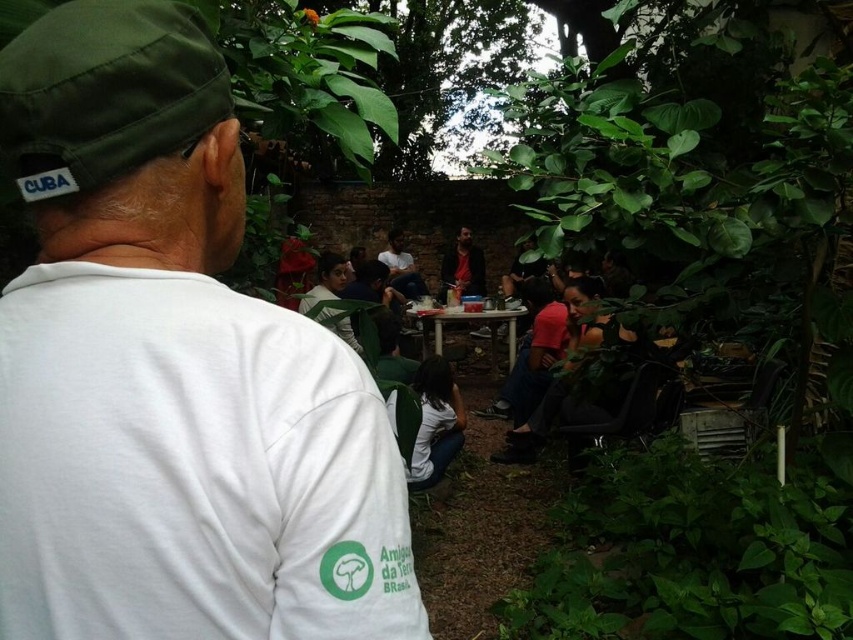
Between white glossy table at center and dark brown leather jacket at center, which one appears on the right side from the viewer's perspective?

From the viewer's perspective, dark brown leather jacket at center appears more on the right side.

Between white glossy table at center and dark brown leather jacket at center, which one is positioned lower?

Positioned lower is white glossy table at center.

Who is more distant from viewer, (437,333) or (456,285)?

The point (456,285) is more distant.

At what (x,y) coordinates should I click in order to perform the action: click on white glossy table at center. Please return your answer as a coordinate pair (x, y). Image resolution: width=853 pixels, height=640 pixels. Looking at the image, I should click on (x=466, y=323).

Between white matte shirt at center and white glossy table at center, which one is positioned lower?

white glossy table at center is below.

Which is in front, point (146, 216) or point (425, 344)?

Point (146, 216) is in front.

Identify the location of white matte shirt at center. The image size is (853, 640). (171, 371).

Between white matte shirt at center and dark brown leather jacket at center, which one is positioned lower?

Positioned lower is white matte shirt at center.

Is white matte shirt at center wider than dark brown leather jacket at center?

In fact, white matte shirt at center might be narrower than dark brown leather jacket at center.

Is point (39, 212) positioned after point (456, 280)?

No.

Find the location of a particular element. This screenshot has width=853, height=640. white matte shirt at center is located at coordinates (171, 371).